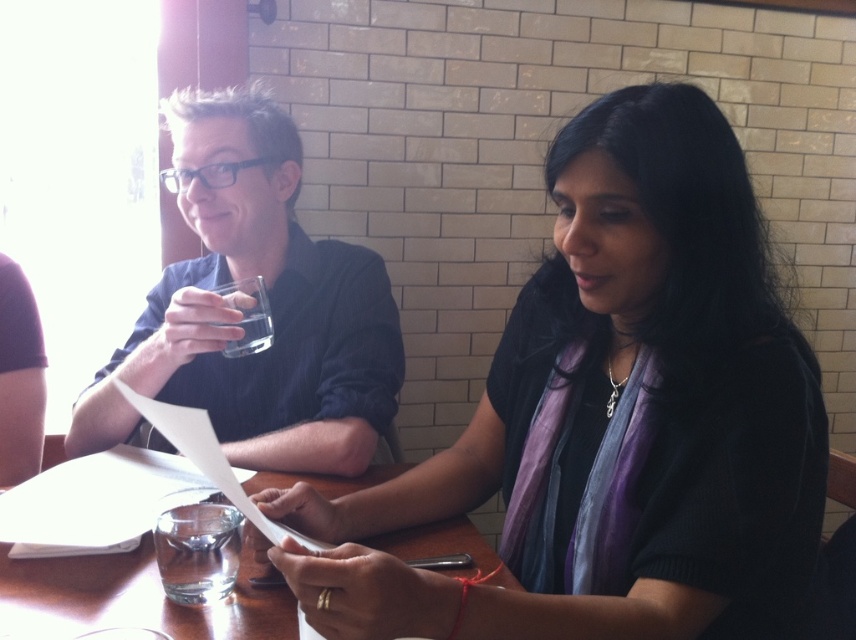
Is point (432, 541) closer to camera compared to point (198, 595)?

No, it is behind (198, 595).

Where is `wooden table at center`? wooden table at center is located at coordinates (134, 596).

Does matte black shirt at left come in front of clear glass at left?

That is True.

You are a GUI agent. You are given a task and a screenshot of the screen. Output one action in this format:
    pyautogui.click(x=<x>, y=<y>)
    Task: Click on the matte black shirt at left
    
    Given the screenshot: What is the action you would take?
    pyautogui.click(x=269, y=301)

Does point (194, 104) come behind point (262, 348)?

Yes, it is.

Where is `matte black shirt at left`? Image resolution: width=856 pixels, height=640 pixels. matte black shirt at left is located at coordinates (269, 301).

What do you see at coordinates (613, 419) in the screenshot?
I see `black matte sweater at center` at bounding box center [613, 419].

Measure the distance between point (635,458) and camera.

A distance of 32.78 inches exists between point (635,458) and camera.

You are a GUI agent. You are given a task and a screenshot of the screen. Output one action in this format:
    pyautogui.click(x=<x>, y=<y>)
    Task: Click on the black matte sweater at center
    
    Given the screenshot: What is the action you would take?
    pyautogui.click(x=613, y=419)